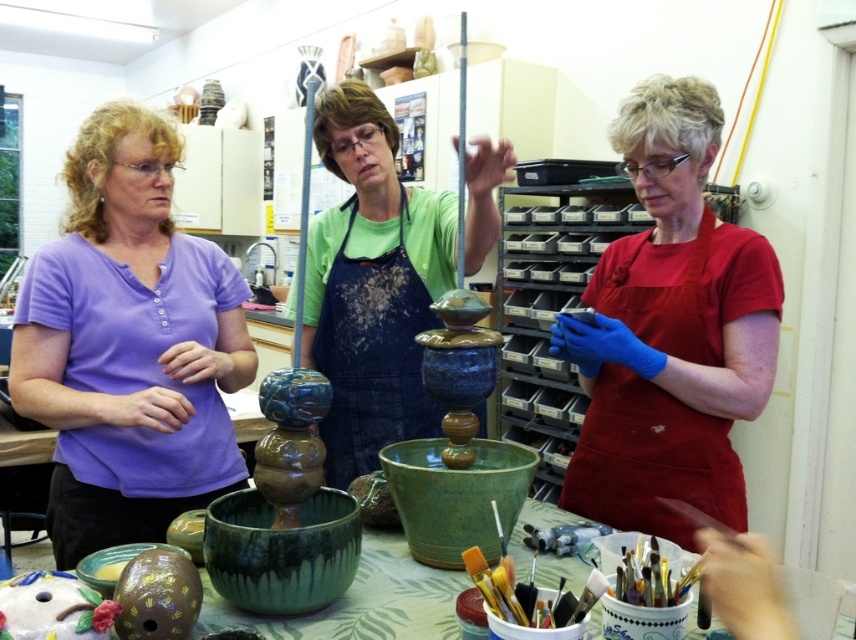
Based on the photo, you are a photographer trying to capture a wide shot of the pottery workshop scene. You notice the purple cotton shirt at left and the blue denim apron at center. Based on their positions, which object might require more space in the frame to avoid being cut off?

The purple cotton shirt at left might require more space in the frame because it is wider than the blue denim apron at center, so it could be at risk of being cut off if the frame isn not adjusted accordingly.

You are a photographer standing behind the blue denim apron at center and want to take a photo of the purple cotton shirt at left without blocking the view. Can you move forward to capture the shot?

The purple cotton shirt at left is in front of the blue denim apron at center, so moving forward might not be necessary as the photographer is already positioned behind the blue denim apron at center and the purple cotton shirt at left is already visible in front.